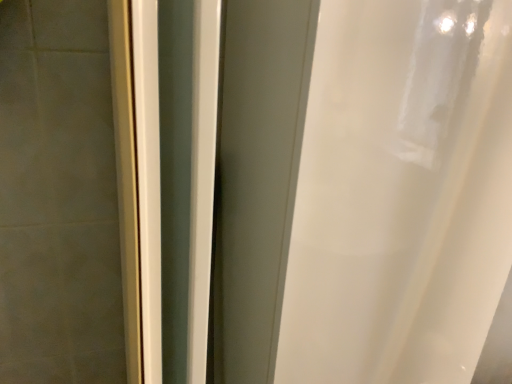
What do you see at coordinates (401, 194) in the screenshot?
I see `white matte shower curtain at center` at bounding box center [401, 194].

This screenshot has height=384, width=512. Find the location of `white matte shower curtain at center`. white matte shower curtain at center is located at coordinates (401, 194).

This screenshot has height=384, width=512. I want to click on white matte shower curtain at center, so click(x=401, y=194).